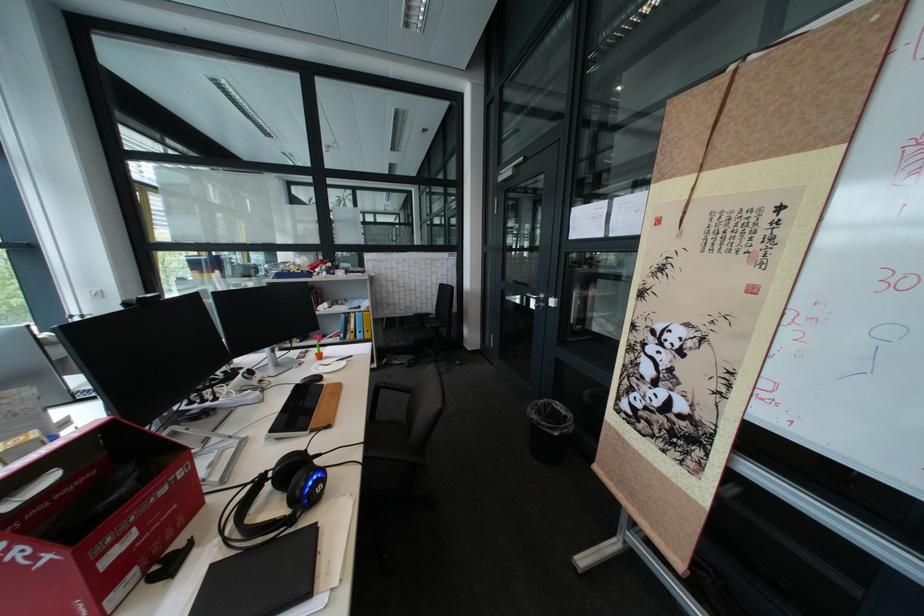
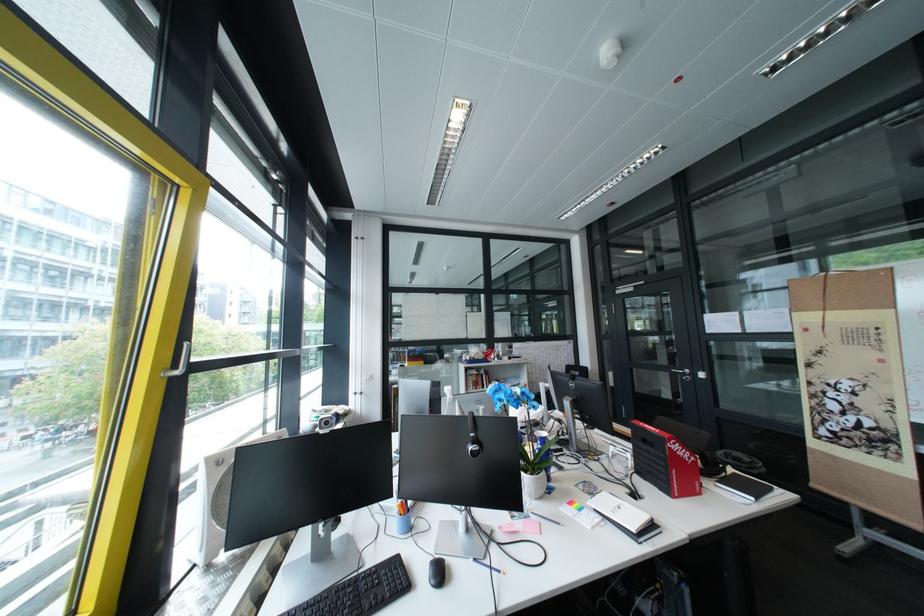
In a continuous first-person perspective shot, in which direction is the camera moving?

The cameraman walked toward left, backward.